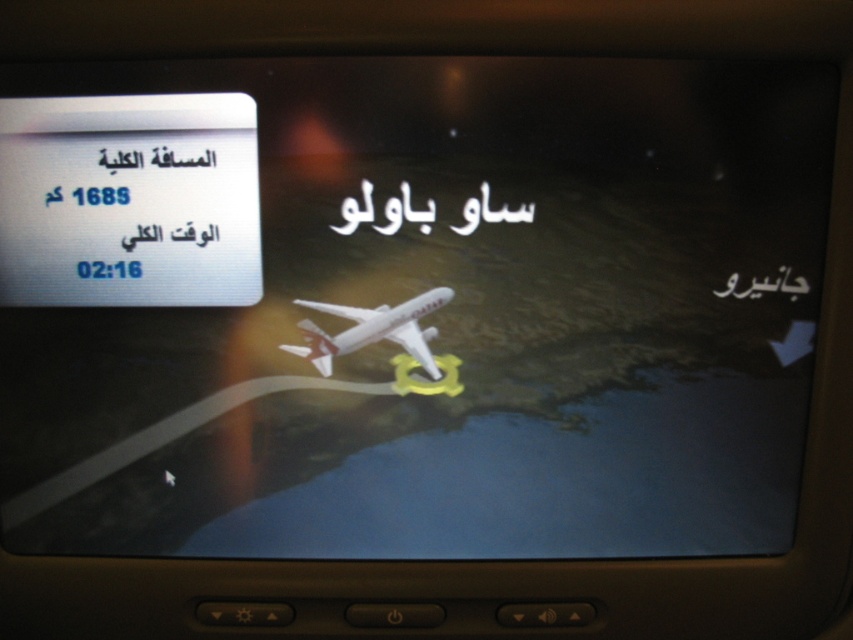
Question: Is white matte airplane at center wider than black paper text at upper center?

Choices:
 (A) no
 (B) yes

Answer: (A)

Question: Can you confirm if white paper at upper left is positioned above black paper text at upper center?

Choices:
 (A) yes
 (B) no

Answer: (B)

Question: Among these objects, which one is farthest from the camera?

Choices:
 (A) white matte airplane at center
 (B) black textured writing at upper right
 (C) black paper text at upper center

Answer: (A)

Question: Which point is closer to the camera?

Choices:
 (A) (751, 280)
 (B) (393, 225)
 (C) (160, 228)

Answer: (C)

Question: Does black paper text at upper center appear under black textured writing at upper right?

Choices:
 (A) yes
 (B) no

Answer: (B)

Question: Which point is closer to the camera?

Choices:
 (A) white paper at upper left
 (B) white matte airplane at center
 (C) black paper text at upper center

Answer: (A)